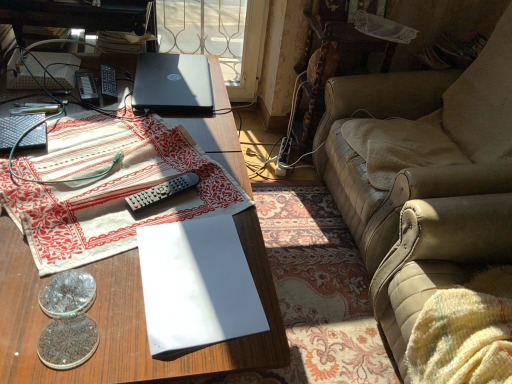
Locate an element on the screen. space that is in front of black plastic remote control at center, which appears as the first remote control when viewed from the back is located at coordinates (89, 117).